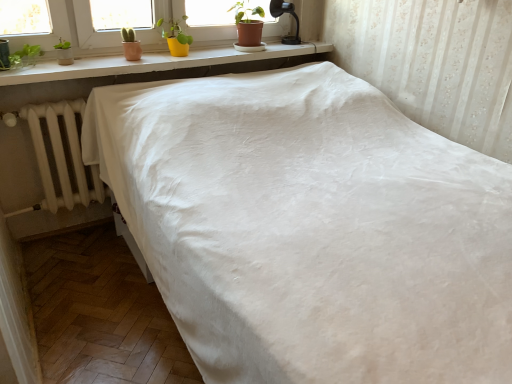
Question: From a real-world perspective, is yellow matte pot at upper center, marked as the first houseplant in a left-to-right arrangement, on white fabric bed at center?

Choices:
 (A) no
 (B) yes

Answer: (B)

Question: From a real-world perspective, is yellow matte pot at upper center, which is the second houseplant in right-to-left order, below white fabric bed at center?

Choices:
 (A) yes
 (B) no

Answer: (B)

Question: Can you confirm if yellow matte pot at upper center, marked as the first houseplant in a left-to-right arrangement, is smaller than white fabric bed at center?

Choices:
 (A) yes
 (B) no

Answer: (A)

Question: Is yellow matte pot at upper center, marked as the first houseplant in a left-to-right arrangement, located outside white fabric bed at center?

Choices:
 (A) yes
 (B) no

Answer: (A)

Question: Is yellow matte pot at upper center, which is the second houseplant in right-to-left order, next to white fabric bed at center?

Choices:
 (A) no
 (B) yes

Answer: (A)

Question: From a real-world perspective, is matte brown pot at upper center, the second houseplant when ordered from left to right, above or below black glass lamp at upper right?

Choices:
 (A) below
 (B) above

Answer: (A)

Question: From their relative heights in the image, would you say matte brown pot at upper center, the second houseplant when ordered from left to right, is taller or shorter than black glass lamp at upper right?

Choices:
 (A) short
 (B) tall

Answer: (B)

Question: Considering their positions, is matte brown pot at upper center, the second houseplant when ordered from left to right, located in front of or behind black glass lamp at upper right?

Choices:
 (A) behind
 (B) front

Answer: (B)

Question: Is matte brown pot at upper center, the 1th houseplant viewed from the right, bigger or smaller than black glass lamp at upper right?

Choices:
 (A) big
 (B) small

Answer: (A)

Question: Considering the relative positions of white matte radiator at left and matte brown pot at upper center, the second houseplant when ordered from left to right, in the image provided, is white matte radiator at left to the left or to the right of matte brown pot at upper center, the second houseplant when ordered from left to right,?

Choices:
 (A) right
 (B) left

Answer: (B)

Question: Considering the positions of point (78, 112) and point (246, 23), is point (78, 112) closer or farther from the camera than point (246, 23)?

Choices:
 (A) closer
 (B) farther

Answer: (A)

Question: In the image, is white matte radiator at left positioned in front of or behind matte brown pot at upper center, the 1th houseplant viewed from the right?

Choices:
 (A) front
 (B) behind

Answer: (A)

Question: From their relative heights in the image, would you say white matte radiator at left is taller or shorter than matte brown pot at upper center, the second houseplant when ordered from left to right?

Choices:
 (A) short
 (B) tall

Answer: (B)

Question: From a real-world perspective, is white fabric bed at center physically located above or below black glass lamp at upper right?

Choices:
 (A) below
 (B) above

Answer: (A)

Question: Is white fabric bed at center wider or thinner than black glass lamp at upper right?

Choices:
 (A) thin
 (B) wide

Answer: (B)